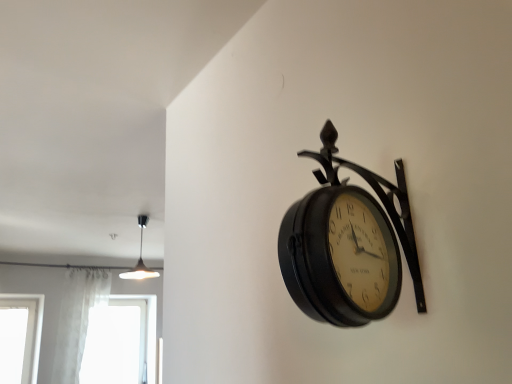
Question: Is matte black clock at upper right touching white sheer curtain at lower left?

Choices:
 (A) yes
 (B) no

Answer: (B)

Question: Does matte black clock at upper right appear on the right side of white sheer curtain at lower left?

Choices:
 (A) no
 (B) yes

Answer: (B)

Question: From the image's perspective, is matte black clock at upper right located above white sheer curtain at lower left?

Choices:
 (A) yes
 (B) no

Answer: (A)

Question: Is matte black clock at upper right positioned behind white sheer curtain at lower left?

Choices:
 (A) yes
 (B) no

Answer: (B)

Question: Is white sheer curtain at lower left at the back of matte black clock at upper right?

Choices:
 (A) yes
 (B) no

Answer: (B)

Question: From a real-world perspective, is matte black clock at upper right below white sheer curtain at lower left?

Choices:
 (A) no
 (B) yes

Answer: (B)

Question: Is white sheer curtain at lower left aimed at transparent glass window at lower left?

Choices:
 (A) no
 (B) yes

Answer: (A)

Question: Does white sheer curtain at lower left appear on the right side of transparent glass window at lower left?

Choices:
 (A) no
 (B) yes

Answer: (A)

Question: From a real-world perspective, is white sheer curtain at lower left located beneath transparent glass window at lower left?

Choices:
 (A) yes
 (B) no

Answer: (B)

Question: Does white sheer curtain at lower left have a lesser width compared to transparent glass window at lower left?

Choices:
 (A) yes
 (B) no

Answer: (A)

Question: Is white sheer curtain at lower left not near transparent glass window at lower left?

Choices:
 (A) yes
 (B) no

Answer: (B)

Question: Considering the relative sizes of white sheer curtain at lower left and transparent glass window at lower left in the image provided, is white sheer curtain at lower left bigger than transparent glass window at lower left?

Choices:
 (A) no
 (B) yes

Answer: (A)

Question: Is matte black pendant light at upper left shorter than transparent glass window at lower left?

Choices:
 (A) no
 (B) yes

Answer: (B)